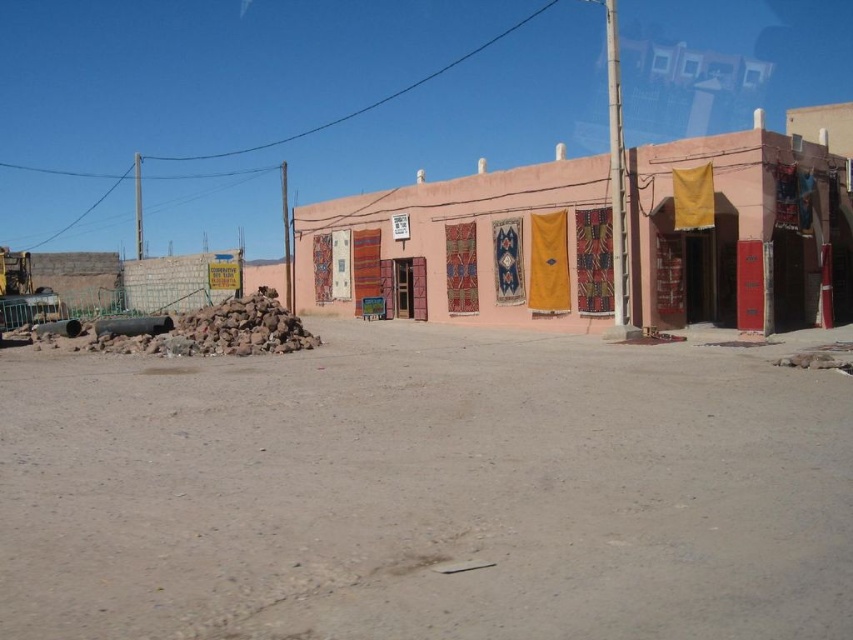
Question: From the image, what is the correct spatial relationship of dull brown dirt at center in relation to textured fabric clothesline at center?

Choices:
 (A) right
 (B) left

Answer: (B)

Question: Can you confirm if dull brown dirt at center is positioned above textured fabric clothesline at center?

Choices:
 (A) no
 (B) yes

Answer: (A)

Question: Considering the relative positions of dull brown dirt at center and textured fabric clothesline at center in the image provided, where is dull brown dirt at center located with respect to textured fabric clothesline at center?

Choices:
 (A) below
 (B) above

Answer: (A)

Question: Which point is farther to the camera?

Choices:
 (A) textured fabric clothesline at center
 (B) dull brown dirt at center

Answer: (A)

Question: Which point is farther from the camera taking this photo?

Choices:
 (A) (86, 445)
 (B) (585, 289)

Answer: (B)